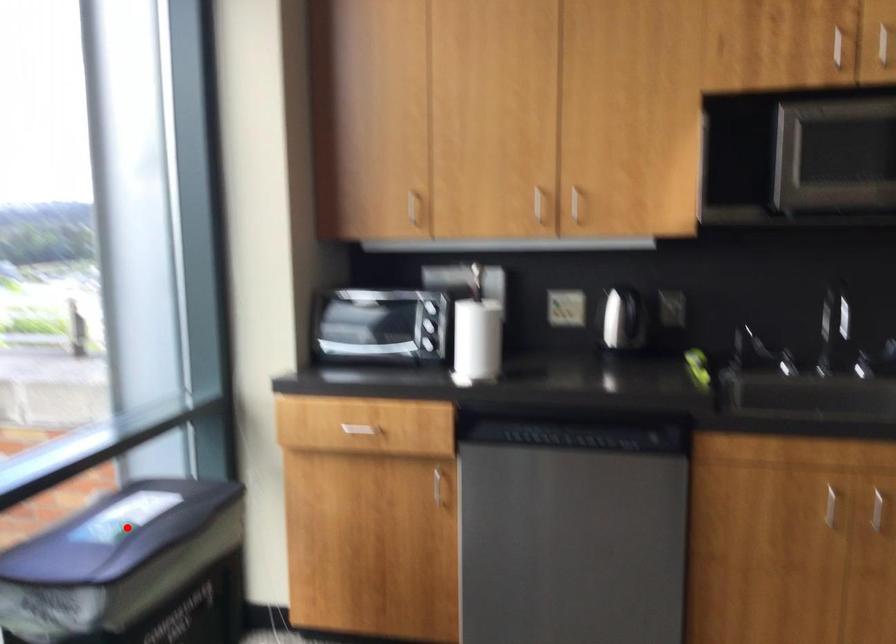
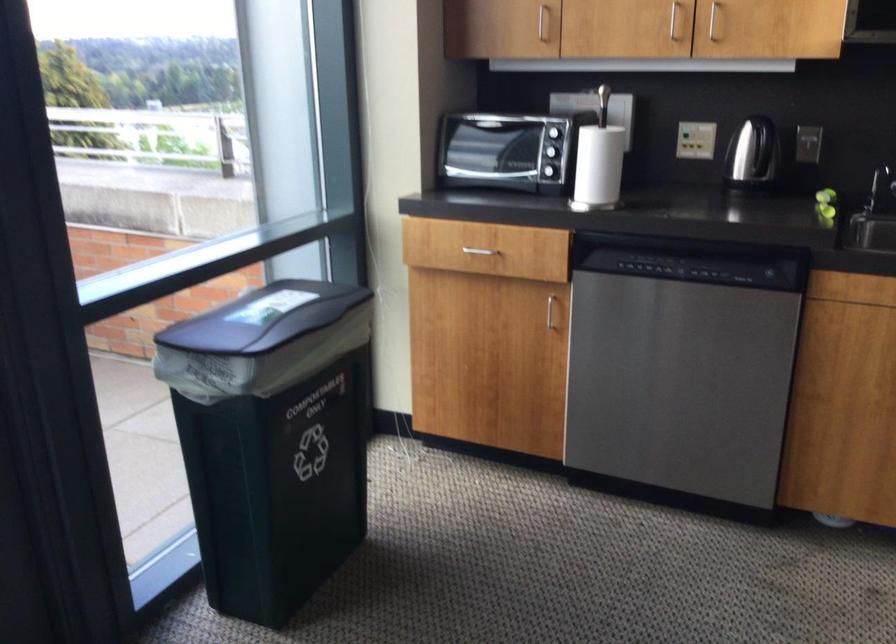
Question: A red point is marked in image1. In image2, is the corresponding 3D point closer to the camera or farther? Reply with the corresponding letter.

Choices:
 (A) The corresponding 3D point is closer.
 (B) The corresponding 3D point is farther.

Answer: (B)